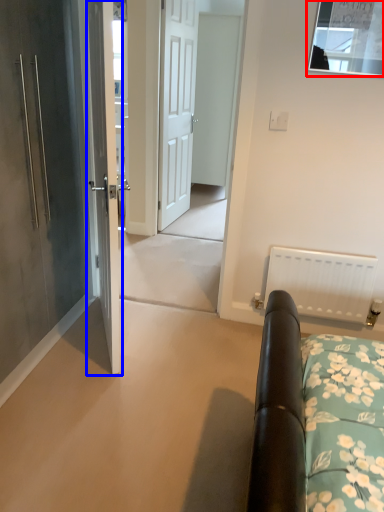
Question: Which object is closer to the camera taking this photo, window (highlighted by a red box) or door (highlighted by a blue box)?

Choices:
 (A) window
 (B) door

Answer: (B)